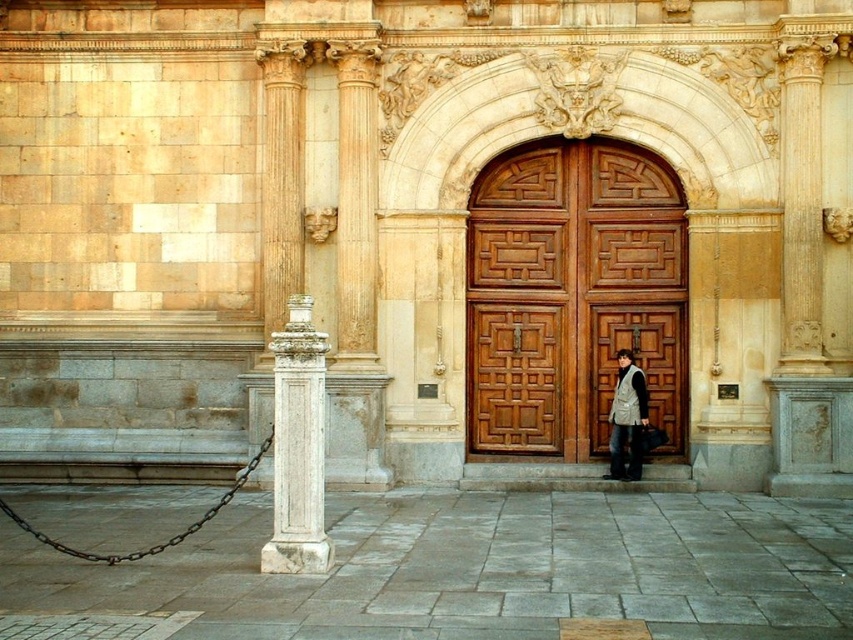
You are standing in front of the grand entrance and want to approach the wooden at center. Which direction should you move relative to the white stone pillar on the left?

The wooden at center is located at point coordinates relative to the scene. Since the white stone pillar is on the left, you should move towards the center from the left side of the entrance to reach the wooden at center.

You are standing at the entrance of the building and want to reach the point marked as point (x=280, y=387). Which direction should you move relative to point (x=637, y=449)?

Since point (x=280, y=387) is in front of point (x=637, y=449), you should move towards the direction closer to the entrance, which is the front side relative to point (x=637, y=449).